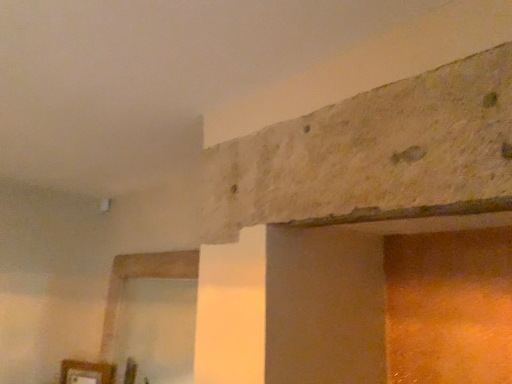
At what (x,y) coordinates should I click in order to perform the action: click on wooden picture frame at lower left. Please return your answer as a coordinate pair (x, y). The height and width of the screenshot is (384, 512). Looking at the image, I should click on (86, 372).

Describe the element at coordinates (86, 372) in the screenshot. I see `wooden picture frame at lower left` at that location.

I want to click on wooden picture frame at lower left, so click(x=86, y=372).